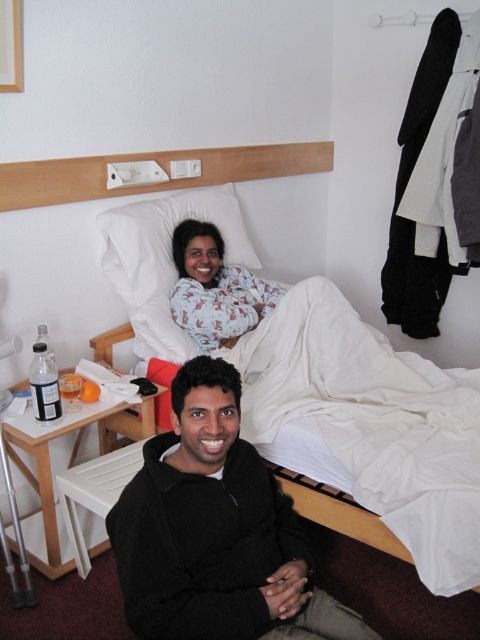
Does white cotton bed at upper center have a lesser width compared to white cotton pajamas at upper center?

No.

Is white cotton bed at upper center shorter than white cotton pajamas at upper center?

No.

The height and width of the screenshot is (640, 480). I want to click on white cotton bed at upper center, so click(336, 397).

Is black fleece jacket at lower center shorter than white cotton pajamas at upper center?

In fact, black fleece jacket at lower center may be taller than white cotton pajamas at upper center.

What do you see at coordinates (216, 531) in the screenshot? I see `black fleece jacket at lower center` at bounding box center [216, 531].

Describe the element at coordinates (216, 531) in the screenshot. I see `black fleece jacket at lower center` at that location.

Locate an element on the screen. The width and height of the screenshot is (480, 640). black fleece jacket at lower center is located at coordinates (216, 531).

Is white soft pillow at upper center positioned before white cotton pajamas at upper center?

Yes, it is.

How distant is white soft pillow at upper center from white cotton pajamas at upper center?

white soft pillow at upper center and white cotton pajamas at upper center are 5.83 inches apart.

Between point (124, 278) and point (194, 252), which one is positioned behind?

The point (194, 252) is more distant.

Where is `white soft pillow at upper center`? This screenshot has width=480, height=640. white soft pillow at upper center is located at coordinates (165, 260).